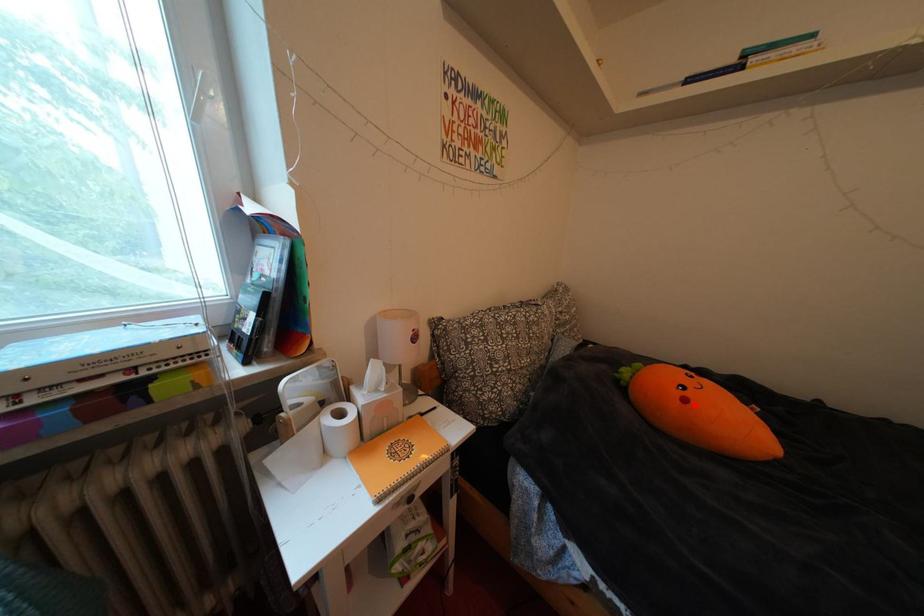
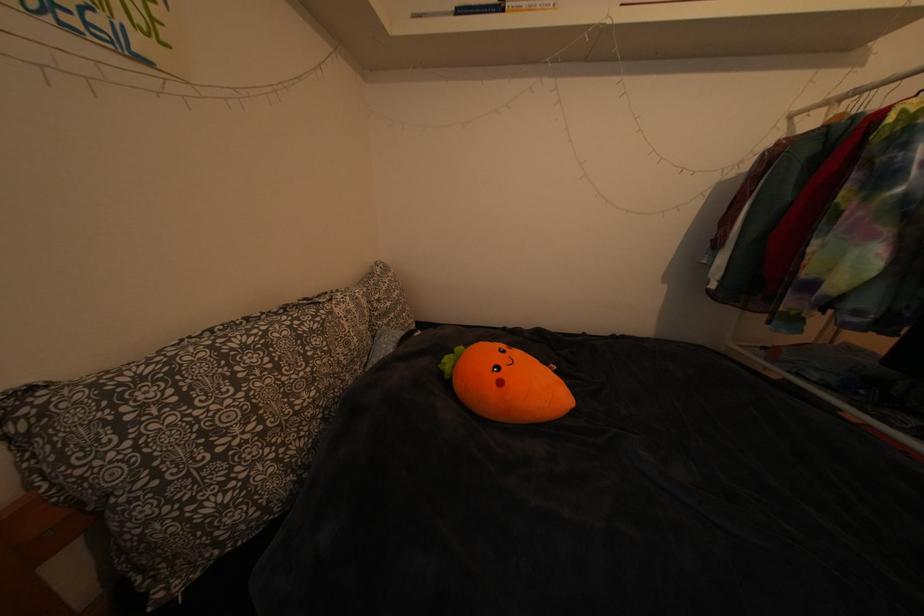
The point at the highlighted location is marked in the first image. Where is the corresponding point in the second image?

(511, 389)